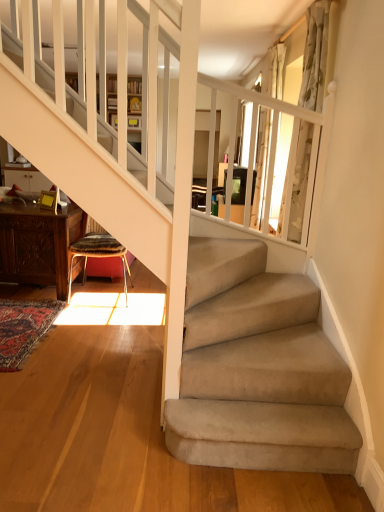
This screenshot has width=384, height=512. What do you see at coordinates (98, 255) in the screenshot?
I see `patterned fabric stool at lower left` at bounding box center [98, 255].

This screenshot has height=512, width=384. Find the location of `carved wood table at lower left`. carved wood table at lower left is located at coordinates tap(38, 244).

This screenshot has width=384, height=512. I want to click on the 2nd curtain to the right when counting from the carved wood table at lower left, so click(266, 163).

Considering the points (34, 225) and (273, 50), which point is in front, point (34, 225) or point (273, 50)?

The point (34, 225) is in front.

Based on their positions, is carved wood table at lower left located to the left or right of white sheer curtain at upper right, the 2th curtain from the front?

Based on their positions, carved wood table at lower left is located to the left of white sheer curtain at upper right, the 2th curtain from the front.

Between carved wood table at lower left and patterned fabric stool at lower left, which one has smaller size?

patterned fabric stool at lower left.

From a real-world perspective, is carved wood table at lower left physically below patterned fabric stool at lower left?

Yes, from a real-world perspective, carved wood table at lower left is beneath patterned fabric stool at lower left.

Locate an element on the screen. chair above the carved wood table at lower left (from a real-world perspective) is located at coordinates (98, 255).

Relative to patterned fabric stool at lower left, is white floral fabric curtain at upper right, which ranks as the 2th curtain in back-to-front order, in front or behind?

Visually, white floral fabric curtain at upper right, which ranks as the 2th curtain in back-to-front order, is located in front of patterned fabric stool at lower left.

Can patterned fabric stool at lower left be found inside white floral fabric curtain at upper right, the first curtain when ordered from front to back?

Actually, patterned fabric stool at lower left is outside white floral fabric curtain at upper right, the first curtain when ordered from front to back.

How distant is white floral fabric curtain at upper right, the first curtain when ordered from front to back, from patterned fabric stool at lower left?

They are 5.87 feet apart.

Can you confirm if white floral fabric curtain at upper right, the first curtain when ordered from front to back, is shorter than patterned fabric stool at lower left?

No, white floral fabric curtain at upper right, the first curtain when ordered from front to back, is not shorter than patterned fabric stool at lower left.

Is patterned fabric stool at lower left wider or thinner than white sheer curtain at upper right, the 2th curtain from the front?

Considering their sizes, patterned fabric stool at lower left looks broader than white sheer curtain at upper right, the 2th curtain from the front.

What's the angular difference between patterned fabric stool at lower left and white sheer curtain at upper right, which is the first curtain in back-to-front order,'s facing directions?

There is a 85.4-degree angle between the facing directions of patterned fabric stool at lower left and white sheer curtain at upper right, which is the first curtain in back-to-front order.

From a real-world perspective, which object stands above the other?

white sheer curtain at upper right, which is the first curtain in back-to-front order, is physically above.

Is patterned fabric stool at lower left oriented towards white sheer curtain at upper right, the 2th curtain from the front?

No.

How many degrees apart are the facing directions of white floral fabric curtain at upper right, which ranks as the 2th curtain in back-to-front order, and white sheer curtain at upper right, the 2th curtain from the front?

There is a 0.000513-degree angle between the facing directions of white floral fabric curtain at upper right, which ranks as the 2th curtain in back-to-front order, and white sheer curtain at upper right, the 2th curtain from the front.

Between white floral fabric curtain at upper right, which ranks as the 2th curtain in back-to-front order, and white sheer curtain at upper right, which is the first curtain in back-to-front order, which one has larger width?

white floral fabric curtain at upper right, which ranks as the 2th curtain in back-to-front order.

Is white floral fabric curtain at upper right, which ranks as the 2th curtain in back-to-front order, turned away from white sheer curtain at upper right, which is the first curtain in back-to-front order?

No, white floral fabric curtain at upper right, which ranks as the 2th curtain in back-to-front order, is not facing the opposite direction of white sheer curtain at upper right, which is the first curtain in back-to-front order.

From the image's perspective, is white floral fabric curtain at upper right, the first curtain when ordered from front to back, on white sheer curtain at upper right, which is the first curtain in back-to-front order?

No, from the image's perspective, white floral fabric curtain at upper right, the first curtain when ordered from front to back, is not above white sheer curtain at upper right, which is the first curtain in back-to-front order.

Between white sheer curtain at upper right, which is the first curtain in back-to-front order, and carved wood table at lower left, which one has larger width?

Wider between the two is carved wood table at lower left.

Does white sheer curtain at upper right, the 2th curtain from the front, have a smaller size compared to carved wood table at lower left?

Correct, white sheer curtain at upper right, the 2th curtain from the front, occupies less space than carved wood table at lower left.

Could carved wood table at lower left be considered to be inside white sheer curtain at upper right, the 2th curtain from the front?

No, white sheer curtain at upper right, the 2th curtain from the front, does not contain carved wood table at lower left.

Looking at their sizes, would you say white floral fabric curtain at upper right, the first curtain when ordered from front to back, is wider or thinner than carved wood table at lower left?

Considering their sizes, white floral fabric curtain at upper right, the first curtain when ordered from front to back, looks slimmer than carved wood table at lower left.

Is white floral fabric curtain at upper right, the first curtain when ordered from front to back, outside of carved wood table at lower left?

Absolutely, white floral fabric curtain at upper right, the first curtain when ordered from front to back, is external to carved wood table at lower left.

Is point (282, 200) positioned after point (13, 228)?

No, it is in front of (13, 228).

Image resolution: width=384 pixels, height=512 pixels. I want to click on table located in front of the white sheer curtain at upper right, the 2th curtain from the front, so click(x=38, y=244).

Find the location of a particular element. The image size is (384, 512). table that is on the left side of patterned fabric stool at lower left is located at coordinates (38, 244).

When comparing their distances from carved wood table at lower left, does patterned fabric stool at lower left or white floral fabric curtain at upper right, the first curtain when ordered from front to back, seem further?

white floral fabric curtain at upper right, the first curtain when ordered from front to back, lies further to carved wood table at lower left than the other object.

Estimate the real-world distances between objects in this image. Which object is closer to white floral fabric curtain at upper right, which ranks as the 2th curtain in back-to-front order, white sheer curtain at upper right, which is the first curtain in back-to-front order, or patterned fabric stool at lower left?

white sheer curtain at upper right, which is the first curtain in back-to-front order, is positioned closer to the anchor white floral fabric curtain at upper right, which ranks as the 2th curtain in back-to-front order.

When comparing their distances from white floral fabric curtain at upper right, which ranks as the 2th curtain in back-to-front order, does carved wood table at lower left or white sheer curtain at upper right, which is the first curtain in back-to-front order, seem further?

carved wood table at lower left.

Estimate the real-world distances between objects in this image. Which object is closer to patterned fabric stool at lower left, white sheer curtain at upper right, the 2th curtain from the front, or carved wood table at lower left?

Based on the image, carved wood table at lower left appears to be nearer to patterned fabric stool at lower left.

Estimate the real-world distances between objects in this image. Which object is closer to white sheer curtain at upper right, the 2th curtain from the front, carved wood table at lower left or patterned fabric stool at lower left?

Among the two, patterned fabric stool at lower left is located nearer to white sheer curtain at upper right, the 2th curtain from the front.

Looking at the image, which one is located closer to white floral fabric curtain at upper right, which ranks as the 2th curtain in back-to-front order, patterned fabric stool at lower left or carved wood table at lower left?

patterned fabric stool at lower left is positioned closer to the anchor white floral fabric curtain at upper right, which ranks as the 2th curtain in back-to-front order.

Considering their positions, is carved wood table at lower left positioned further to patterned fabric stool at lower left than white floral fabric curtain at upper right, which ranks as the 2th curtain in back-to-front order?

white floral fabric curtain at upper right, which ranks as the 2th curtain in back-to-front order, lies further to patterned fabric stool at lower left than the other object.

Estimate the real-world distances between objects in this image. Which object is further from white floral fabric curtain at upper right, the first curtain when ordered from front to back, patterned fabric stool at lower left or white sheer curtain at upper right, the 2th curtain from the front?

The object further to white floral fabric curtain at upper right, the first curtain when ordered from front to back, is patterned fabric stool at lower left.

Image resolution: width=384 pixels, height=512 pixels. Identify the location of curtain between carved wood table at lower left and white sheer curtain at upper right, which is the first curtain in back-to-front order, from left to right. (315, 56).

Image resolution: width=384 pixels, height=512 pixels. I want to click on curtain situated between patterned fabric stool at lower left and white sheer curtain at upper right, the 2th curtain from the front, from left to right, so click(315, 56).

Identify the location of chair between carved wood table at lower left and white sheer curtain at upper right, the 2th curtain from the front. The height and width of the screenshot is (512, 384). (98, 255).

Find the location of a particular element. This screenshot has width=384, height=512. chair situated between carved wood table at lower left and white floral fabric curtain at upper right, the first curtain when ordered from front to back, from left to right is located at coordinates (98, 255).